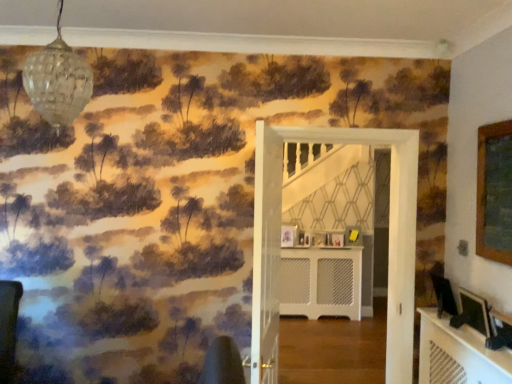
Question: Would you say matte black picture frame at lower right, the first picture frame positioned from the front, is inside or outside white textured radiator at center?

Choices:
 (A) inside
 (B) outside

Answer: (B)

Question: From the image's perspective, relative to white textured radiator at center, is matte black picture frame at lower right, the fifth picture frame viewed from the back, above or below?

Choices:
 (A) below
 (B) above

Answer: (B)

Question: Estimate the real-world distances between objects in this image. Which object is farther from the clear glass globe at upper left?

Choices:
 (A) matte black picture frame at center, the 5th picture frame in the right-to-left sequence
 (B) wooden picture frame at center, placed as the second picture frame when sorted from left to right
 (C) yellow matte picture frame at center, marked as the fifth picture frame in a front-to-back arrangement
 (D) white wooden door at center, the first door positioned from the back
 (E) white textured radiator at center

Answer: (E)

Question: Which of these objects is positioned farthest from the white mesh door at center, placed as the second door when sorted from back to front?

Choices:
 (A) clear glass globe at upper left
 (B) matte black picture frame at lower right, the second picture frame in the right-to-left sequence
 (C) yellow matte picture frame at center, arranged as the 5th picture frame when viewed from the left
 (D) wooden picture frame at center, which appears as the fourth picture frame when viewed from the right
 (E) white wooden door at center, the first door positioned from the back

Answer: (C)